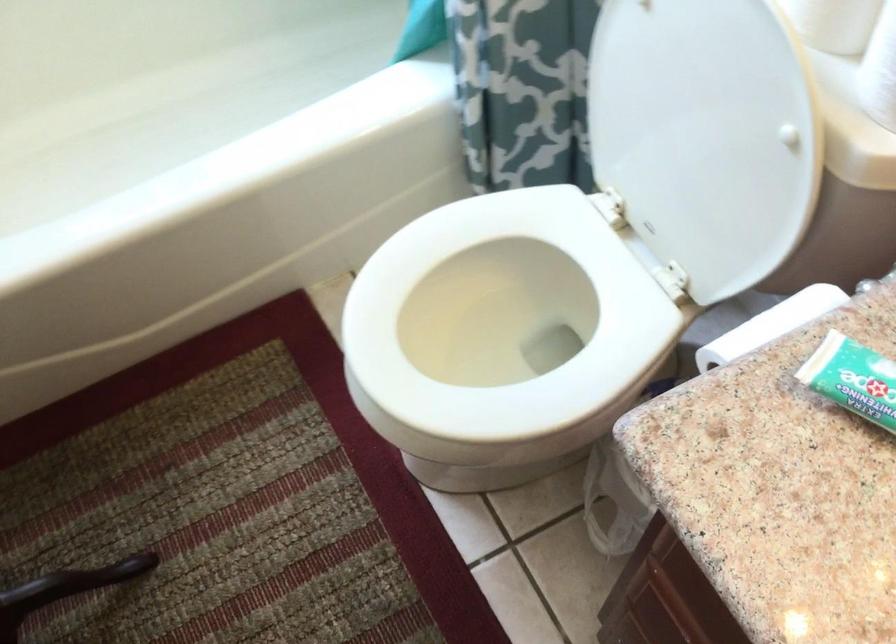
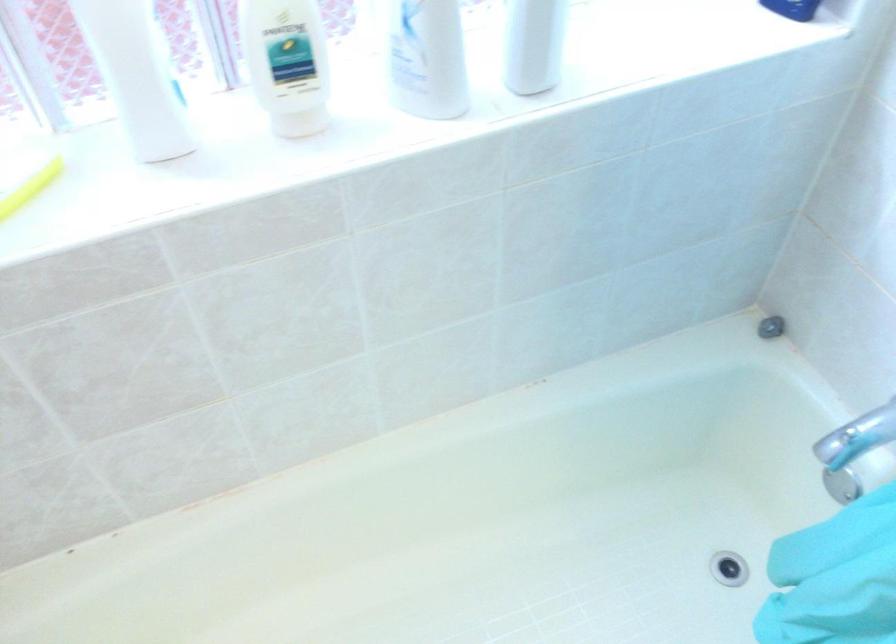
Question: The images are taken continuously from a first-person perspective. In which direction is your viewpoint rotating?

Choices:
 (A) Left
 (B) Right
 (C) Up
 (D) Down

Answer: (C)